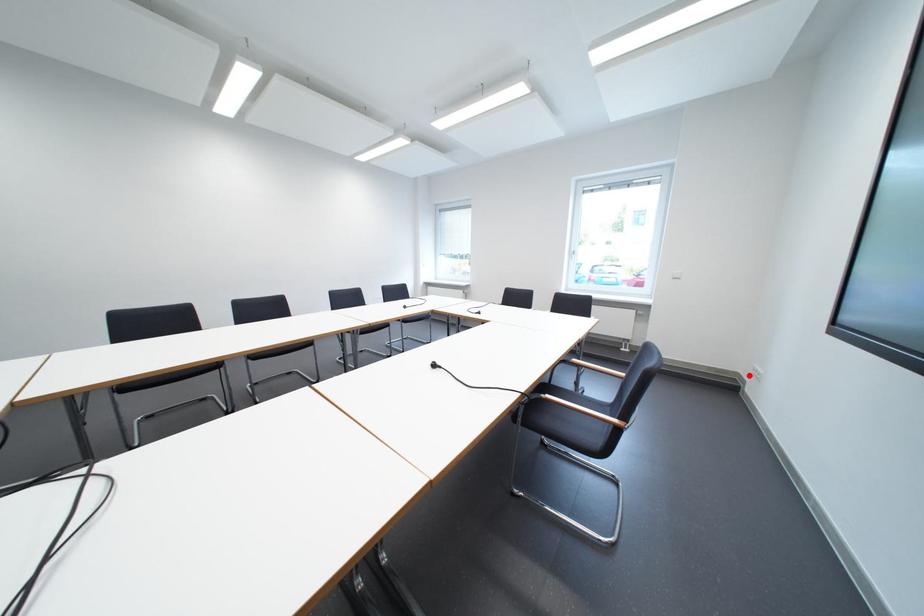
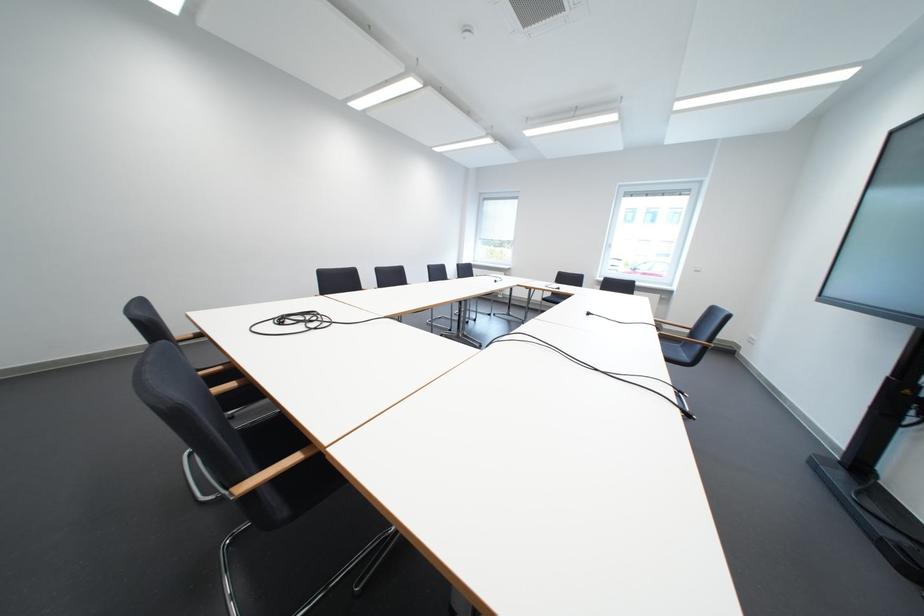
Find the pixel in the second image that matches the highlighted location in the first image.

(746, 345)